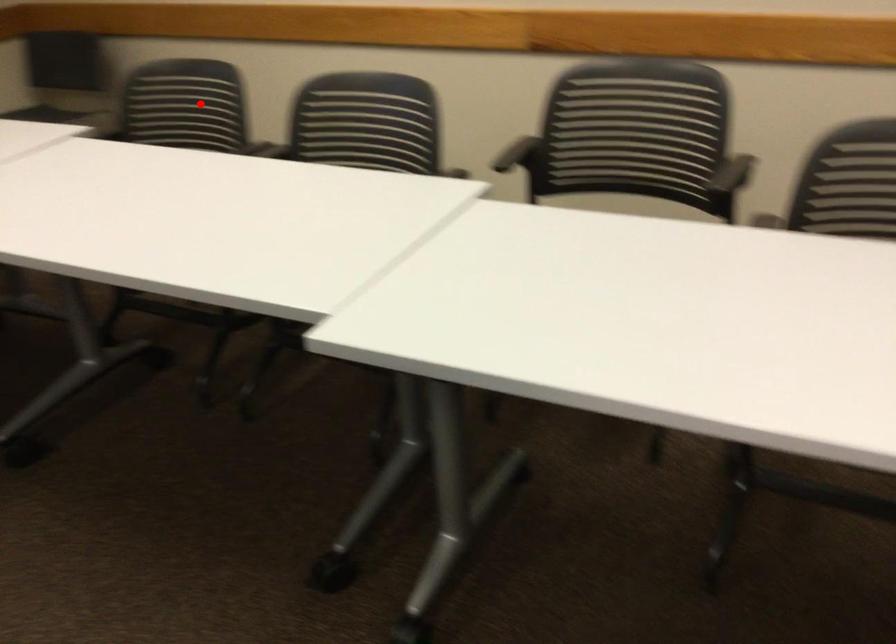
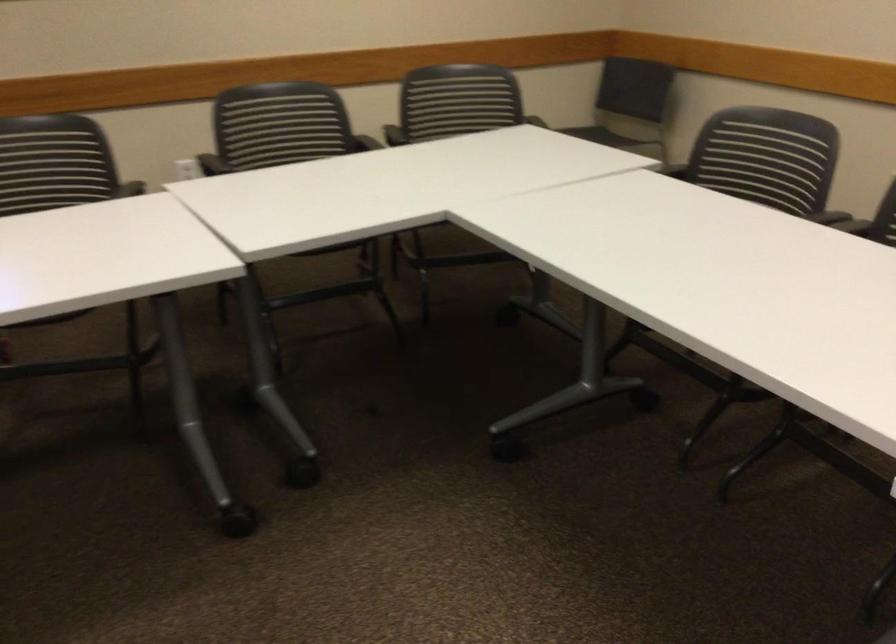
In the second image, find the point that corresponds to the highlighted location in the first image.

(767, 156)